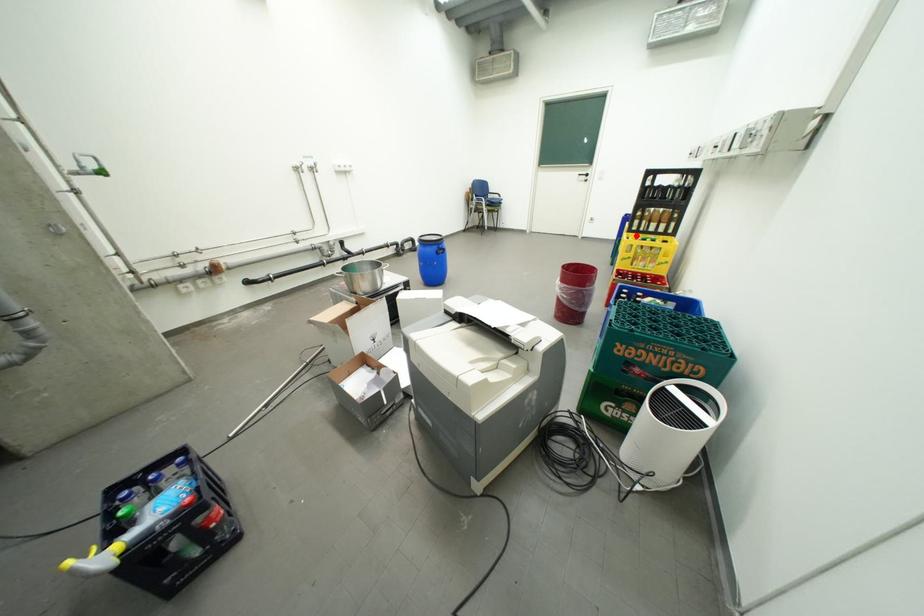
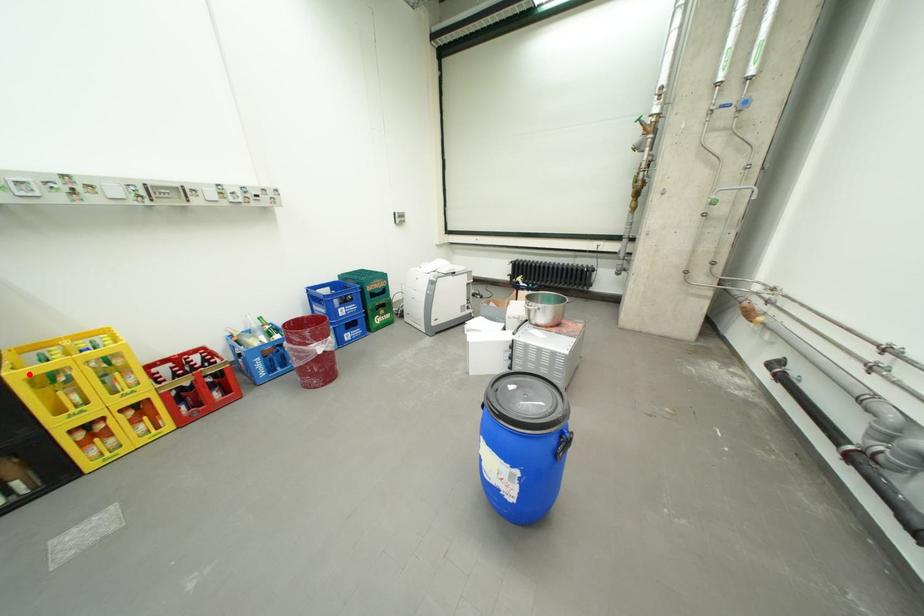
I am providing you with two images of the same scene from different viewpoints. A red point is marked on the first image and another point is marked on the second image. Is the red point in image1 aligned with the point shown in image2?

Yes